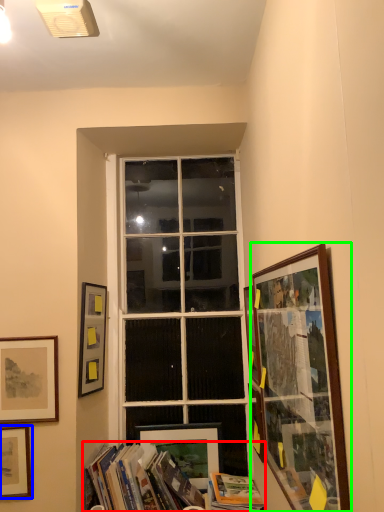
Question: Which is nearer to the book (highlighted by a red box)? picture frame (highlighted by a blue box) or picture frame (highlighted by a green box).

Choices:
 (A) picture frame
 (B) picture frame

Answer: (A)